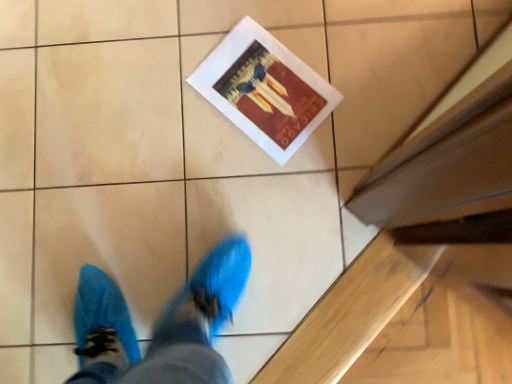
Describe the element at coordinates (265, 89) in the screenshot. I see `matte paper postcard at center` at that location.

In order to face matte paper postcard at center, should I rotate leftwards or rightwards?

Turn right approximately 1.536 degrees to face it.

The image size is (512, 384). What are the coordinates of `matte paper postcard at center` in the screenshot? It's located at (265, 89).

This screenshot has width=512, height=384. What are the coordinates of `matte paper postcard at center` in the screenshot? It's located at (265, 89).